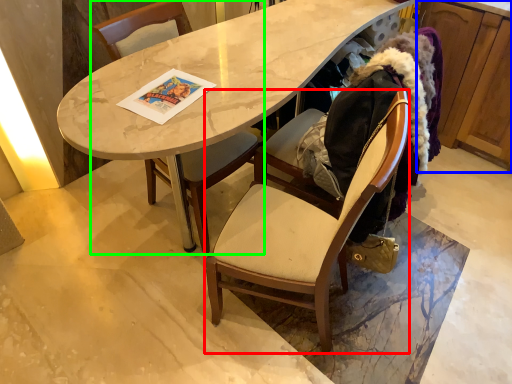
Question: Which object is positioned closest to chair (highlighted by a red box)? Select from cabinetry (highlighted by a blue box) and chair (highlighted by a green box).

Choices:
 (A) cabinetry
 (B) chair

Answer: (B)